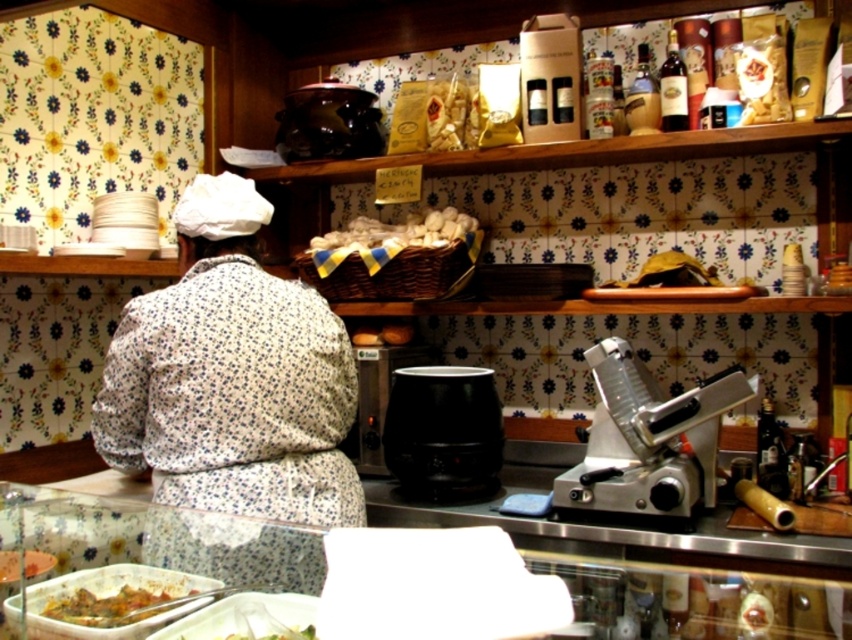
Question: Which is nearer to the stainless steel counter at center?

Choices:
 (A) green leafy vegetables at lower left
 (B) white floral apron at center
 (C) green leafy vegetable at lower center

Answer: (C)

Question: Where is stainless steel counter at center located in relation to green leafy vegetables at lower left in the image?

Choices:
 (A) left
 (B) right

Answer: (B)

Question: Which of the following is the closest to the observer?

Choices:
 (A) (294, 636)
 (B) (113, 612)

Answer: (A)

Question: Can you confirm if stainless steel counter at center is bigger than green leafy vegetable at lower center?

Choices:
 (A) no
 (B) yes

Answer: (B)

Question: Which object appears farthest from the camera in this image?

Choices:
 (A) white floral apron at center
 (B) stainless steel counter at center

Answer: (A)

Question: Is white floral apron at center above green leafy vegetables at lower left?

Choices:
 (A) yes
 (B) no

Answer: (A)